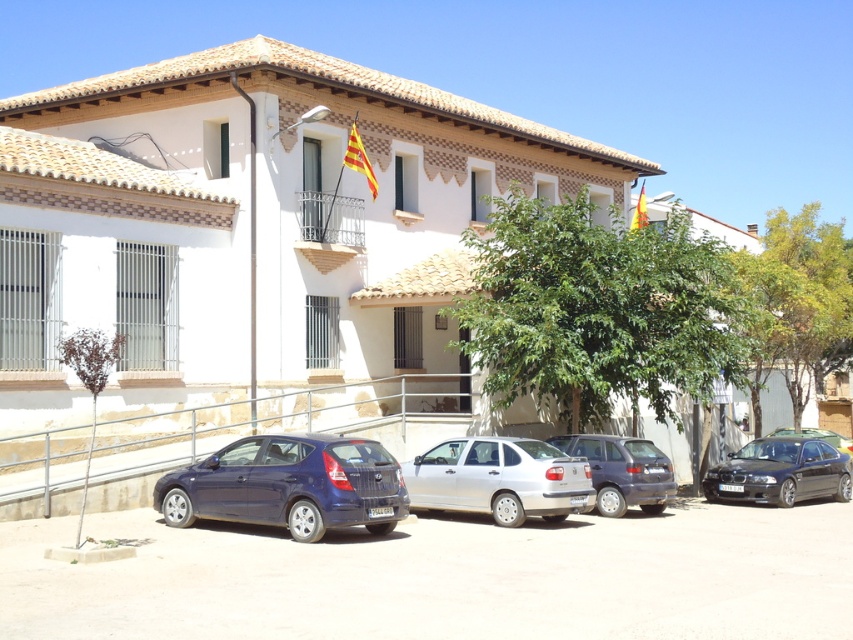
Question: Which object is positioned farthest from the satin silver sedan at lower right?

Choices:
 (A) green leafy tree at center
 (B) matte gray hatchback at center
 (C) brown textured tree at lower left
 (D) green leafy tree at right

Answer: (C)

Question: Which object is farther from the camera taking this photo?

Choices:
 (A) shiny black sedan at right
 (B) matte gray hatchback at center
 (C) green leafy tree at right
 (D) satin blue hatchback at lower left

Answer: (C)

Question: Can you confirm if satin blue hatchback at lower left is thinner than silver metallic sedan at center?

Choices:
 (A) yes
 (B) no

Answer: (B)

Question: Is green leafy tree at center behind green leafy tree at right?

Choices:
 (A) yes
 (B) no

Answer: (B)

Question: Considering the real-world distances, which object is farthest from the green leafy tree at center?

Choices:
 (A) silver metallic sedan at center
 (B) green leafy tree at right
 (C) matte gray hatchback at center
 (D) satin silver sedan at lower right

Answer: (B)

Question: Is green leafy tree at right smaller than shiny black sedan at right?

Choices:
 (A) no
 (B) yes

Answer: (A)